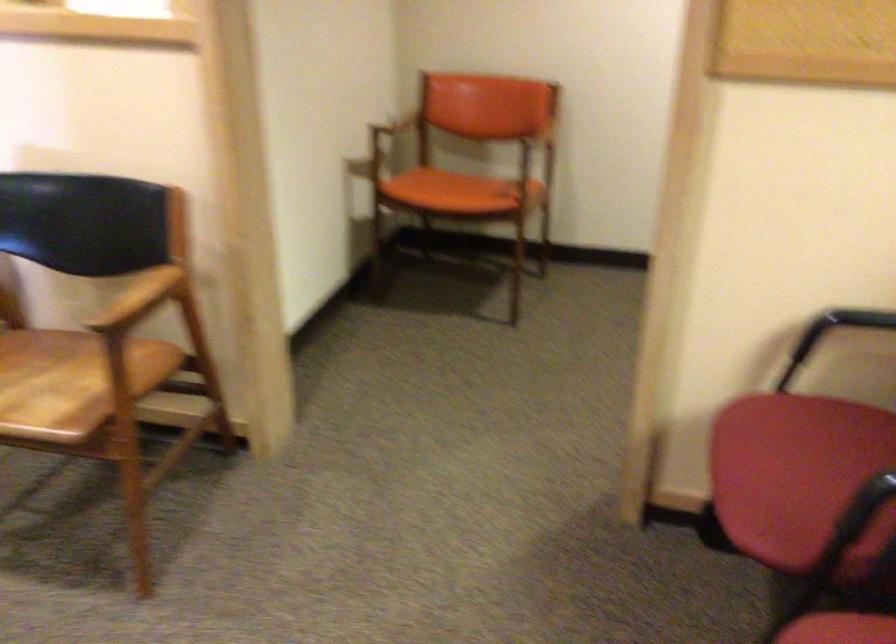
What do you see at coordinates (139, 299) in the screenshot?
I see `the wooden chair armrest` at bounding box center [139, 299].